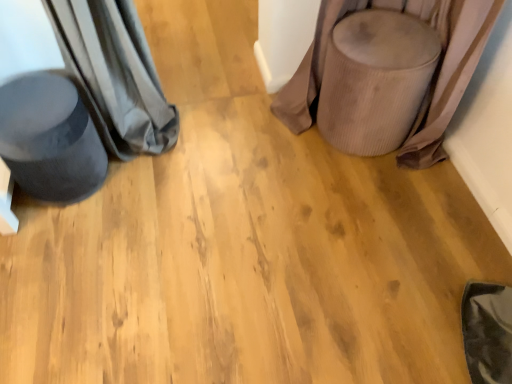
What do you see at coordinates (375, 80) in the screenshot?
I see `velvet beige stool at right, acting as the 2th swivel chair starting from the left` at bounding box center [375, 80].

At what (x,y) coordinates should I click in order to perform the action: click on velvet beige stool at right, acting as the 2th swivel chair starting from the left. Please return your answer as a coordinate pair (x, y). This screenshot has width=512, height=384. Looking at the image, I should click on (375, 80).

What do you see at coordinates (50, 138) in the screenshot? I see `velvet dark grey swivel chair at left, which is the 1th swivel chair in left-to-right order` at bounding box center [50, 138].

Find the location of a particular element. velvet dark grey swivel chair at left, which is the 1th swivel chair in left-to-right order is located at coordinates (50, 138).

In order to face velvet dark grey swivel chair at left, which is the second swivel chair in right-to-left order, should I rotate leftwards or rightwards?

Turn left approximately 25.580 degrees to face it.

This screenshot has height=384, width=512. I want to click on velvet beige stool at right, arranged as the first swivel chair when viewed from the right, so click(x=375, y=80).

Which is more to the right, velvet beige stool at right, arranged as the first swivel chair when viewed from the right, or velvet dark grey swivel chair at left, which is the 1th swivel chair in left-to-right order?

From the viewer's perspective, velvet beige stool at right, arranged as the first swivel chair when viewed from the right, appears more on the right side.

Is velvet beige stool at right, arranged as the first swivel chair when viewed from the right, in front of or behind velvet dark grey swivel chair at left, which is the second swivel chair in right-to-left order, in the image?

velvet beige stool at right, arranged as the first swivel chair when viewed from the right, is positioned farther from the viewer than velvet dark grey swivel chair at left, which is the second swivel chair in right-to-left order.

Is point (339, 83) farther from camera compared to point (91, 127)?

That is True.

From the image's perspective, is velvet beige stool at right, acting as the 2th swivel chair starting from the left, on top of velvet dark grey swivel chair at left, which is the second swivel chair in right-to-left order?

Yes, from the image's perspective, velvet beige stool at right, acting as the 2th swivel chair starting from the left, is on top of velvet dark grey swivel chair at left, which is the second swivel chair in right-to-left order.

From a real-world perspective, is velvet beige stool at right, acting as the 2th swivel chair starting from the left, under velvet dark grey swivel chair at left, which is the second swivel chair in right-to-left order?

No, from a real-world perspective, velvet beige stool at right, acting as the 2th swivel chair starting from the left, is not under velvet dark grey swivel chair at left, which is the second swivel chair in right-to-left order.

Considering the sizes of objects velvet beige stool at right, arranged as the first swivel chair when viewed from the right, and velvet dark grey swivel chair at left, which is the second swivel chair in right-to-left order, in the image provided, who is wider, velvet beige stool at right, arranged as the first swivel chair when viewed from the right, or velvet dark grey swivel chair at left, which is the second swivel chair in right-to-left order,?

velvet beige stool at right, arranged as the first swivel chair when viewed from the right.

Is velvet beige stool at right, arranged as the first swivel chair when viewed from the right, shorter than velvet dark grey swivel chair at left, which is the second swivel chair in right-to-left order?

In fact, velvet beige stool at right, arranged as the first swivel chair when viewed from the right, may be taller than velvet dark grey swivel chair at left, which is the second swivel chair in right-to-left order.

Which of these two, velvet beige stool at right, acting as the 2th swivel chair starting from the left, or velvet dark grey swivel chair at left, which is the second swivel chair in right-to-left order, is bigger?

Bigger between the two is velvet beige stool at right, acting as the 2th swivel chair starting from the left.

Would you say velvet beige stool at right, arranged as the first swivel chair when viewed from the right, contains velvet dark grey swivel chair at left, which is the second swivel chair in right-to-left order?

No, velvet beige stool at right, arranged as the first swivel chair when viewed from the right, does not contain velvet dark grey swivel chair at left, which is the second swivel chair in right-to-left order.

Consider the image. Is velvet beige stool at right, arranged as the first swivel chair when viewed from the right, far away from velvet dark grey swivel chair at left, which is the second swivel chair in right-to-left order?

Absolutely, velvet beige stool at right, arranged as the first swivel chair when viewed from the right, is distant from velvet dark grey swivel chair at left, which is the second swivel chair in right-to-left order.

Does velvet beige stool at right, acting as the 2th swivel chair starting from the left, turn towards velvet dark grey swivel chair at left, which is the 1th swivel chair in left-to-right order?

No, velvet beige stool at right, acting as the 2th swivel chair starting from the left, is not oriented towards velvet dark grey swivel chair at left, which is the 1th swivel chair in left-to-right order.

How many degrees apart are the facing directions of velvet beige stool at right, acting as the 2th swivel chair starting from the left, and velvet dark grey swivel chair at left, which is the 1th swivel chair in left-to-right order?

velvet beige stool at right, acting as the 2th swivel chair starting from the left, and velvet dark grey swivel chair at left, which is the 1th swivel chair in left-to-right order, are facing 9.99 degrees away from each other.

Where is `swivel chair below the velvet beige stool at right, acting as the 2th swivel chair starting from the left (from the image's perspective)`? swivel chair below the velvet beige stool at right, acting as the 2th swivel chair starting from the left (from the image's perspective) is located at coordinates (50, 138).

Is velvet dark grey swivel chair at left, which is the second swivel chair in right-to-left order, to the left of velvet beige stool at right, acting as the 2th swivel chair starting from the left, from the viewer's perspective?

Correct, you'll find velvet dark grey swivel chair at left, which is the second swivel chair in right-to-left order, to the left of velvet beige stool at right, acting as the 2th swivel chair starting from the left.

Which object is closer to the camera, velvet dark grey swivel chair at left, which is the 1th swivel chair in left-to-right order, or velvet beige stool at right, arranged as the first swivel chair when viewed from the right?

velvet dark grey swivel chair at left, which is the 1th swivel chair in left-to-right order, is closer to the camera.

Which is nearer, (16, 106) or (384, 134)?

Point (16, 106) appears to be closer to the viewer than point (384, 134).

Consider the image. From the image's perspective, is velvet dark grey swivel chair at left, which is the 1th swivel chair in left-to-right order, under velvet beige stool at right, acting as the 2th swivel chair starting from the left?

Yes, from the image's perspective, velvet dark grey swivel chair at left, which is the 1th swivel chair in left-to-right order, is beneath velvet beige stool at right, acting as the 2th swivel chair starting from the left.

From a real-world perspective, which object rests below the other?

velvet dark grey swivel chair at left, which is the 1th swivel chair in left-to-right order, from a real-world perspective.

Considering the relative sizes of velvet dark grey swivel chair at left, which is the 1th swivel chair in left-to-right order, and velvet beige stool at right, acting as the 2th swivel chair starting from the left, in the image provided, is velvet dark grey swivel chair at left, which is the 1th swivel chair in left-to-right order, thinner than velvet beige stool at right, acting as the 2th swivel chair starting from the left,?

Yes.

Considering the relative sizes of velvet dark grey swivel chair at left, which is the 1th swivel chair in left-to-right order, and velvet beige stool at right, arranged as the first swivel chair when viewed from the right, in the image provided, is velvet dark grey swivel chair at left, which is the 1th swivel chair in left-to-right order, shorter than velvet beige stool at right, arranged as the first swivel chair when viewed from the right,?

Indeed, velvet dark grey swivel chair at left, which is the 1th swivel chair in left-to-right order, has a lesser height compared to velvet beige stool at right, arranged as the first swivel chair when viewed from the right.

Considering the sizes of objects velvet dark grey swivel chair at left, which is the second swivel chair in right-to-left order, and velvet beige stool at right, arranged as the first swivel chair when viewed from the right, in the image provided, who is smaller, velvet dark grey swivel chair at left, which is the second swivel chair in right-to-left order, or velvet beige stool at right, arranged as the first swivel chair when viewed from the right,?

velvet dark grey swivel chair at left, which is the second swivel chair in right-to-left order, is smaller.

Is velvet dark grey swivel chair at left, which is the 1th swivel chair in left-to-right order, inside or outside of velvet beige stool at right, arranged as the first swivel chair when viewed from the right?

velvet dark grey swivel chair at left, which is the 1th swivel chair in left-to-right order, is not enclosed by velvet beige stool at right, arranged as the first swivel chair when viewed from the right.

Is velvet dark grey swivel chair at left, which is the second swivel chair in right-to-left order, not close to velvet beige stool at right, arranged as the first swivel chair when viewed from the right?

Absolutely, velvet dark grey swivel chair at left, which is the second swivel chair in right-to-left order, is distant from velvet beige stool at right, arranged as the first swivel chair when viewed from the right.

Is velvet dark grey swivel chair at left, which is the 1th swivel chair in left-to-right order, facing towards velvet beige stool at right, acting as the 2th swivel chair starting from the left?

No, velvet dark grey swivel chair at left, which is the 1th swivel chair in left-to-right order, does not turn towards velvet beige stool at right, acting as the 2th swivel chair starting from the left.

From the picture: Can you tell me how much velvet dark grey swivel chair at left, which is the second swivel chair in right-to-left order, and velvet beige stool at right, acting as the 2th swivel chair starting from the left, differ in facing direction?

The facing directions of velvet dark grey swivel chair at left, which is the second swivel chair in right-to-left order, and velvet beige stool at right, acting as the 2th swivel chair starting from the left, are 9.99 degrees apart.

You are a GUI agent. You are given a task and a screenshot of the screen. Output one action in this format:
    pyautogui.click(x=<x>, y=<y>)
    Task: Click on the swivel chair behind the velvet dark grey swivel chair at left, which is the second swivel chair in right-to-left order
    The image size is (512, 384).
    Given the screenshot: What is the action you would take?
    pyautogui.click(x=375, y=80)

The height and width of the screenshot is (384, 512). In the image, there is a velvet dark grey swivel chair at left, which is the 1th swivel chair in left-to-right order. What are the coordinates of `swivel chair above it (from the image's perspective)` in the screenshot? It's located at (375, 80).

Locate an element on the screen. This screenshot has width=512, height=384. swivel chair in front of the velvet beige stool at right, arranged as the first swivel chair when viewed from the right is located at coordinates (50, 138).